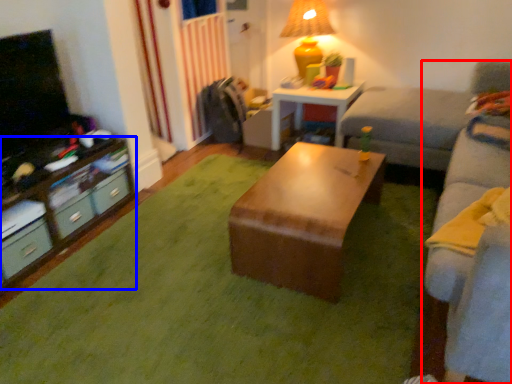
Question: Which of the following is the farthest to the observer, studio couch (highlighted by a red box) or desk (highlighted by a blue box)?

Choices:
 (A) studio couch
 (B) desk

Answer: (B)